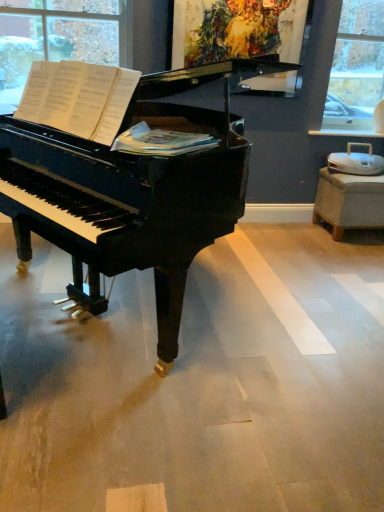
The width and height of the screenshot is (384, 512). What do you see at coordinates (124, 178) in the screenshot? I see `glossy black piano at center` at bounding box center [124, 178].

This screenshot has width=384, height=512. Identify the location of glossy black piano at center. (124, 178).

The image size is (384, 512). In order to click on glossy black piano at center in this screenshot , I will do `click(124, 178)`.